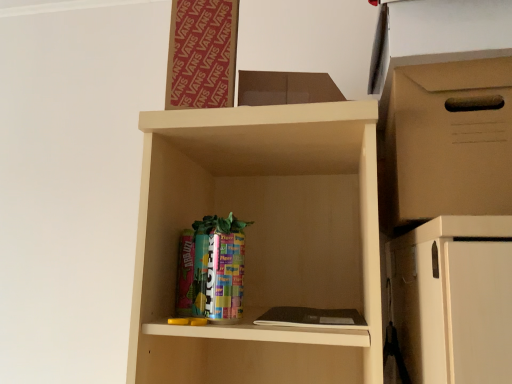
Describe the element at coordinates (202, 54) in the screenshot. I see `red cardboard bulletin board at upper center` at that location.

Identify the location of red cardboard bulletin board at upper center. Image resolution: width=512 pixels, height=384 pixels. (202, 54).

Describe the element at coordinates (449, 140) in the screenshot. I see `brown cardboard box at right` at that location.

Find the location of `brown cardboard box at right`. brown cardboard box at right is located at coordinates click(x=449, y=140).

Find the location of `red cardboard bulletin board at upper center`. red cardboard bulletin board at upper center is located at coordinates (202, 54).

Does brown cardboard box at right appear on the right side of red cardboard bulletin board at upper center?

Yes.

Is brown cardboard box at right closer to the viewer compared to red cardboard bulletin board at upper center?

Yes, brown cardboard box at right is in front of red cardboard bulletin board at upper center.

Is point (399, 180) positioned in front of point (230, 54)?

Yes.

From the image's perspective, between brown cardboard box at right and red cardboard bulletin board at upper center, who is located below?

brown cardboard box at right.

From a real-world perspective, is brown cardboard box at right on top of red cardboard bulletin board at upper center?

No, from a real-world perspective, brown cardboard box at right is not over red cardboard bulletin board at upper center

Which of these two, brown cardboard box at right or red cardboard bulletin board at upper center, is wider?

brown cardboard box at right.

Does brown cardboard box at right have a lesser height compared to red cardboard bulletin board at upper center?

Indeed, brown cardboard box at right has a lesser height compared to red cardboard bulletin board at upper center.

Based on their sizes in the image, would you say brown cardboard box at right is bigger or smaller than red cardboard bulletin board at upper center?

brown cardboard box at right is bigger than red cardboard bulletin board at upper center.

Is red cardboard bulletin board at upper center surrounded by brown cardboard box at right?

Actually, red cardboard bulletin board at upper center is outside brown cardboard box at right.

Would you consider brown cardboard box at right to be distant from red cardboard bulletin board at upper center?

brown cardboard box at right is near red cardboard bulletin board at upper center, not far away.

Is brown cardboard box at right oriented towards red cardboard bulletin board at upper center?

No, brown cardboard box at right is not aimed at red cardboard bulletin board at upper center.

Measure the distance between brown cardboard box at right and red cardboard bulletin board at upper center.

They are 36.05 centimeters apart.

Find the location of a particular element. storage box that appears on the right of red cardboard bulletin board at upper center is located at coordinates (449, 140).

Is red cardboard bulletin board at upper center at the left side of brown cardboard box at right?

Yes.

Based on the photo, is red cardboard bulletin board at upper center in front of brown cardboard box at right?

No, red cardboard bulletin board at upper center is further to the viewer.

Does point (172, 63) appear closer or farther from the camera than point (489, 120)?

Point (172, 63) is farther from the camera than point (489, 120).

From the image's perspective, is red cardboard bulletin board at upper center positioned above or below brown cardboard box at right?

Clearly, from the image's perspective, red cardboard bulletin board at upper center is above brown cardboard box at right.

From a real-world perspective, between red cardboard bulletin board at upper center and brown cardboard box at right, who is vertically higher?

red cardboard bulletin board at upper center.

Can you confirm if red cardboard bulletin board at upper center is thinner than brown cardboard box at right?

Correct, the width of red cardboard bulletin board at upper center is less than that of brown cardboard box at right.

Looking at this image, from their relative heights in the image, would you say red cardboard bulletin board at upper center is taller or shorter than brown cardboard box at right?

Clearly, red cardboard bulletin board at upper center is taller compared to brown cardboard box at right.

Does red cardboard bulletin board at upper center have a smaller size compared to brown cardboard box at right?

Indeed, red cardboard bulletin board at upper center has a smaller size compared to brown cardboard box at right.

Is red cardboard bulletin board at upper center spatially inside brown cardboard box at right, or outside of it?

red cardboard bulletin board at upper center exists outside the volume of brown cardboard box at right.

Is red cardboard bulletin board at upper center positioned far away from brown cardboard box at right?

No, red cardboard bulletin board at upper center is not far from brown cardboard box at right.

Is red cardboard bulletin board at upper center facing away from brown cardboard box at right?

red cardboard bulletin board at upper center does not have its back to brown cardboard box at right.

This screenshot has height=384, width=512. Find the location of `bulletin board lying on the left of brown cardboard box at right`. bulletin board lying on the left of brown cardboard box at right is located at coordinates (x=202, y=54).

Image resolution: width=512 pixels, height=384 pixels. What are the coordinates of `bulletin board on the left side of brown cardboard box at right` in the screenshot? It's located at (202, 54).

You are a GUI agent. You are given a task and a screenshot of the screen. Output one action in this format:
    pyautogui.click(x=<x>, y=<y>)
    Task: Click on the storage box on the right of red cardboard bulletin board at upper center
    The height and width of the screenshot is (384, 512).
    Given the screenshot: What is the action you would take?
    pyautogui.click(x=449, y=140)